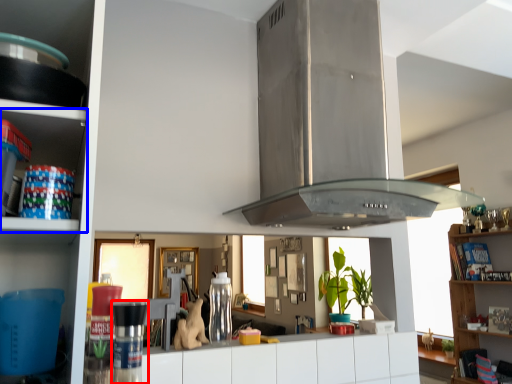
Question: Among these objects, which one is farthest to the camera, appliance (highlighted by a red box) or shelf (highlighted by a blue box)?

Choices:
 (A) appliance
 (B) shelf

Answer: (A)